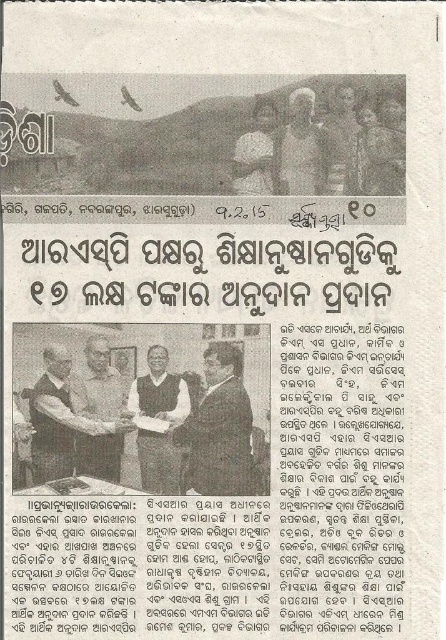
Is dark gray sweater at center shorter than gray textured shirt at center?

In fact, dark gray sweater at center may be taller than gray textured shirt at center.

Which is more to the right, dark gray sweater at center or gray textured shirt at center?

gray textured shirt at center is more to the right.

Does point (177, 410) lie behind point (289, 115)?

Yes, point (177, 410) is farther from viewer.

I want to click on dark gray sweater at center, so click(159, 392).

Which of these two, dark gray sweater at center or matte black shirt at center, stands taller?

Standing taller between the two is dark gray sweater at center.

Is dark gray sweater at center further to camera compared to matte black shirt at center?

No, it is in front of matte black shirt at center.

Who is more distant from viewer, (174, 488) or (263, 166)?

Positioned behind is point (263, 166).

Identify the location of dark gray sweater at center. Image resolution: width=446 pixels, height=640 pixels. (159, 392).

Is point (280, 141) positioned after point (325, 132)?

Yes.

This screenshot has width=446, height=640. I want to click on gray textured shirt at center, so coord(300,148).

The height and width of the screenshot is (640, 446). Identify the location of gray textured shirt at center. tap(300, 148).